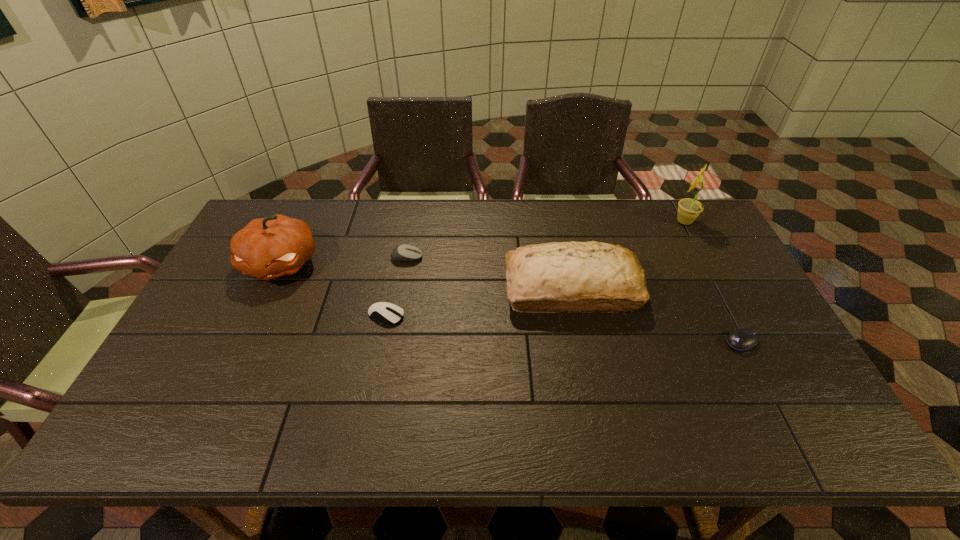
You are a GUI agent. You are given a task and a screenshot of the screen. Output one action in this format:
    pyautogui.click(x=<x>, y=<y>)
    Task: Click on the object that is at the left edge
    
    Given the screenshot: What is the action you would take?
    pyautogui.click(x=267, y=248)

This screenshot has width=960, height=540. In order to click on sunflower located in the right edge section of the desktop in this screenshot , I will do `click(689, 209)`.

At what (x,y) coordinates should I click in order to perform the action: click on computer mouse located at the right edge. Please return your answer as a coordinate pair (x, y). The image size is (960, 540). Looking at the image, I should click on (742, 339).

Identify the location of object at the far left corner. The height and width of the screenshot is (540, 960). (267, 248).

The width and height of the screenshot is (960, 540). Identify the location of object that is at the far right corner. (689, 209).

The height and width of the screenshot is (540, 960). Find the location of `vacant space at the far edge of the desktop`. vacant space at the far edge of the desktop is located at coordinates (629, 218).

The width and height of the screenshot is (960, 540). In the image, there is a desktop. Find the location of `vacant area at the near edge`. vacant area at the near edge is located at coordinates (745, 430).

At what (x,y) coordinates should I click in order to perform the action: click on vacant region at the left edge of the desktop. Please return your answer as a coordinate pair (x, y). The height and width of the screenshot is (540, 960). Looking at the image, I should click on (246, 328).

Locate an element on the screen. free region at the right edge of the desktop is located at coordinates (753, 357).

Identify the location of vacant region at the near right corner of the desktop. The image size is (960, 540). tap(842, 442).